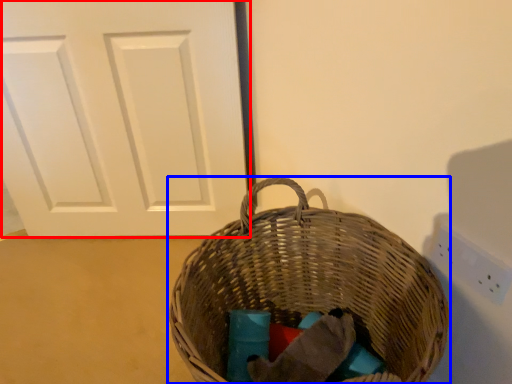
Question: Among these objects, which one is nearest to the camera, door (highlighted by a red box) or picnic basket (highlighted by a blue box)?

Choices:
 (A) door
 (B) picnic basket

Answer: (B)